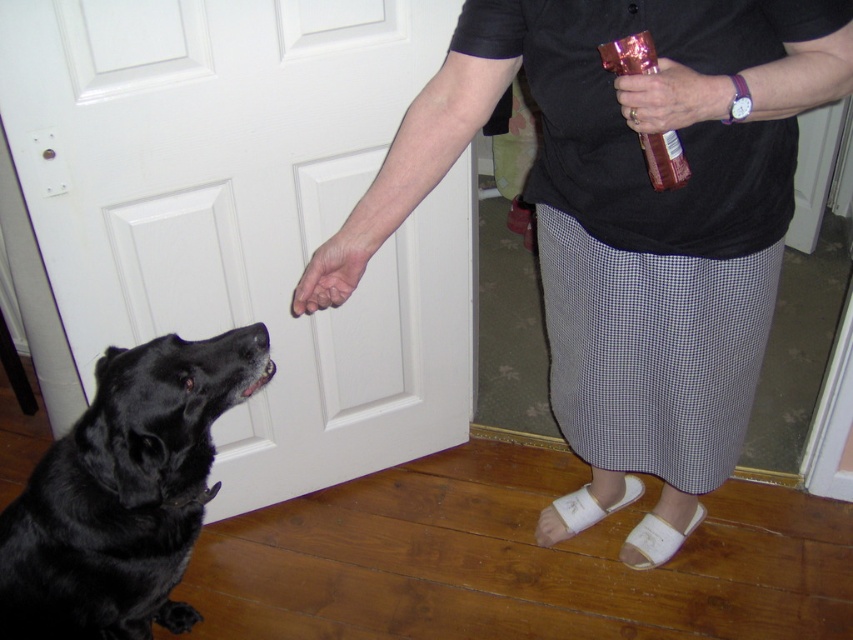
You are a delivery robot trying to navigate through the living room. You need to place a package on the tallest object between the matte black skirt at center and the metallic pink can at upper right. Which object should you choose?

The matte black skirt at center is taller than the metallic pink can at upper right, so you should choose the matte black skirt at center to place the package.